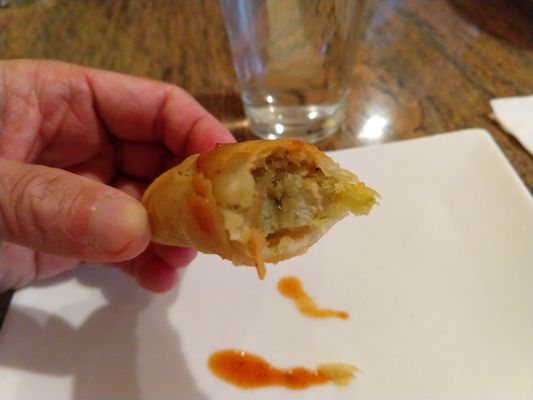
Where is `empty glass`? empty glass is located at coordinates (317, 53).